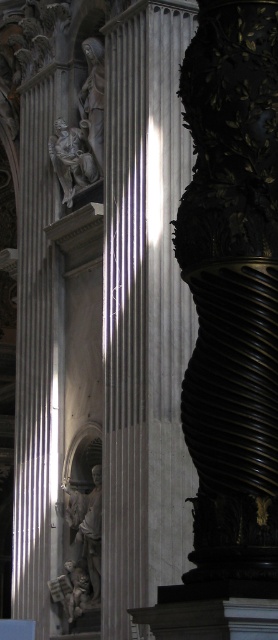
Question: Is white marble column at center wider than polished marble statue at upper center?

Choices:
 (A) no
 (B) yes

Answer: (B)

Question: Is white marble column at center positioned at the back of polished marble statue at upper center?

Choices:
 (A) yes
 (B) no

Answer: (B)

Question: Is white marble column at center bigger than polished marble statue at upper center?

Choices:
 (A) yes
 (B) no

Answer: (A)

Question: Which point appears closest to the camera in this image?

Choices:
 (A) (87, 104)
 (B) (184, 509)

Answer: (B)